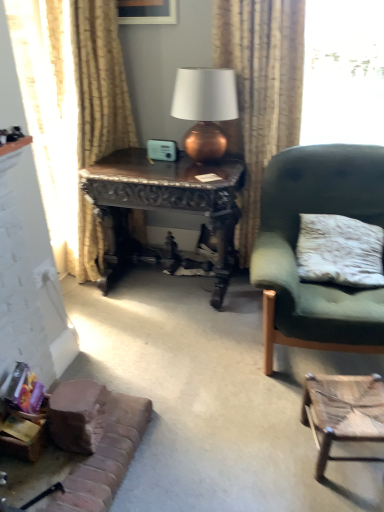
Question: Considering the relative positions of wooden woven stool at lower right and textured beige curtain at upper center, the second curtain in the left-to-right sequence, in the image provided, is wooden woven stool at lower right to the left or to the right of textured beige curtain at upper center, the second curtain in the left-to-right sequence,?

Choices:
 (A) left
 (B) right

Answer: (B)

Question: From the image's perspective, is wooden woven stool at lower right positioned above or below textured beige curtain at upper center, the second curtain in the left-to-right sequence?

Choices:
 (A) above
 (B) below

Answer: (B)

Question: Which object is the closest to the dark wood carved desk at center?

Choices:
 (A) brown fabric couch at lower left
 (B) copper metallic lamp at upper center
 (C) velvet green armchair at right
 (D) textured beige curtain at upper center, marked as the 1th curtain in a right-to-left arrangement
 (E) beige textured curtain at left, placed as the second curtain when sorted from right to left

Answer: (B)

Question: Which object is positioned closest to the brown fabric couch at lower left?

Choices:
 (A) dark wood carved desk at center
 (B) wooden picture frame at upper center
 (C) wooden woven stool at lower right
 (D) velvet green armchair at right
 (E) textured beige curtain at upper center, the second curtain in the left-to-right sequence

Answer: (C)